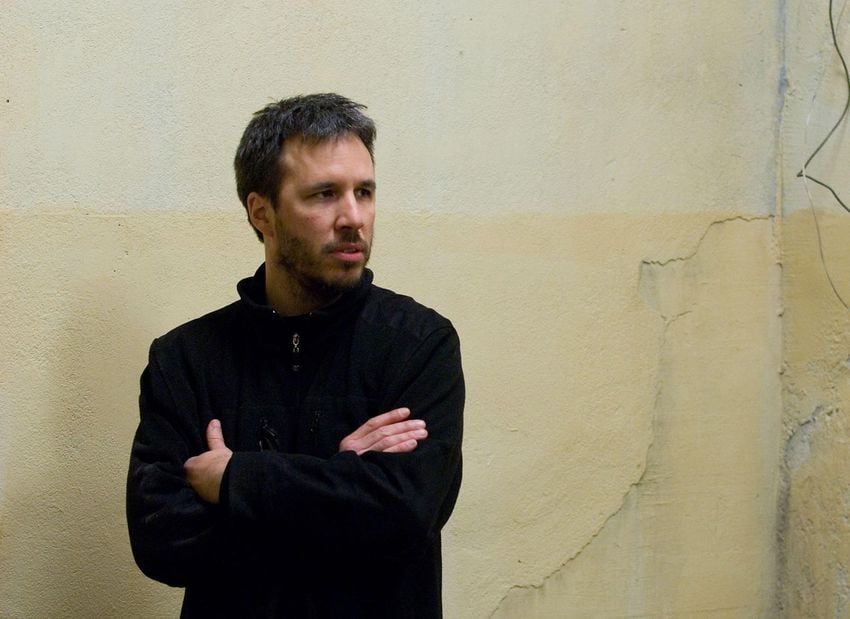
At what (x,y) coordinates should I click in order to perform the action: click on areas of cracked or missing plaster. Please return your answer as a coordinate pair (x, y). Looking at the image, I should click on (801, 447), (663, 371), (609, 514), (665, 291).